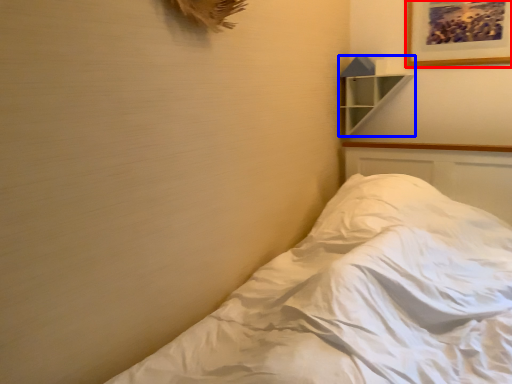
Question: Among these objects, which one is nearest to the camera, picture frame (highlighted by a red box) or shelf (highlighted by a blue box)?

Choices:
 (A) picture frame
 (B) shelf

Answer: (A)